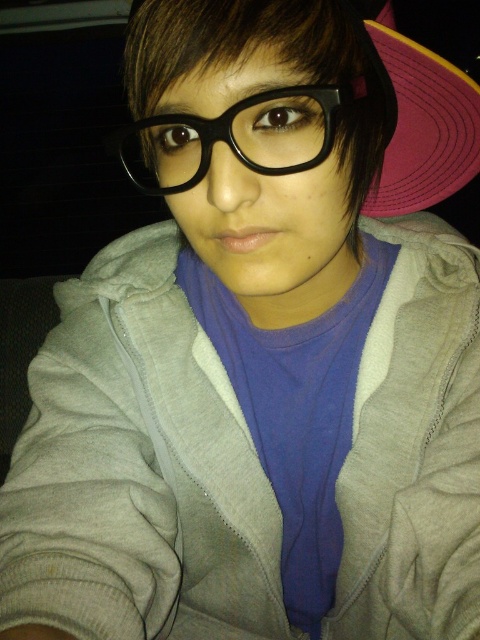
You are a photographer trying to capture a closeup of the black plastic glasses at center while ensuring the pink fabric baseball hat at upper right is still visible in the frame. Given their positions, will you need to adjust your camera angle to keep both in view?

The pink fabric baseball hat at upper right is further to the viewer than black plastic glasses at center, so adjusting the camera angle slightly backward might be necessary to ensure both the black plastic glasses at center and the pink fabric baseball hat at upper right remain in the frame.

You are trying to determine the distance between two points in the image. Given that point A is at coordinates point(x=389, y=205) and point B is at coordinates point(x=312, y=164), which point is closer to you?

Point point(x=312, y=164) is closer to the viewer than point point(x=389, y=205) because the Objects Description states that point(x=389, y=205) is further to the viewer than point(x=312, y=164).

You are trying to determine if the pink fabric baseball hat at upper right is covering the black plastic glasses at center. Based on the scene description, can you confirm if the hat is obscuring the glasses?

The pink fabric baseball hat at upper right is positioned over black plastic glasses at center, so yes, the hat is obscuring the glasses.